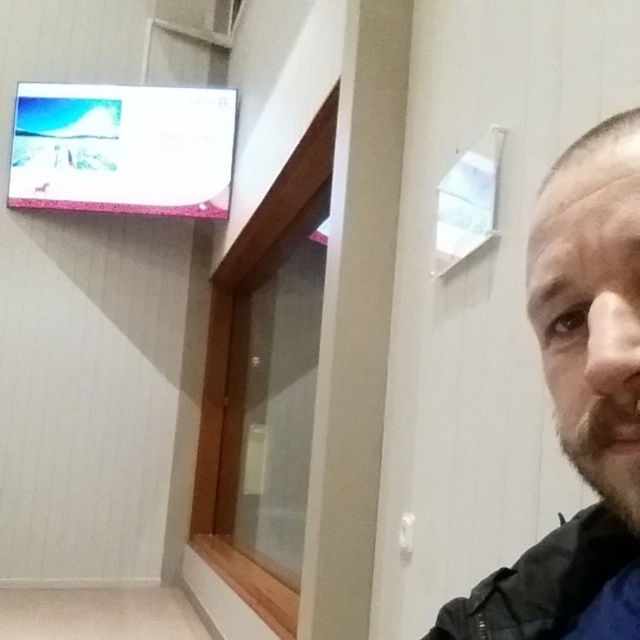
Question: Which point is farther to the camera?

Choices:
 (A) brown fuzzy beard at lower right
 (B) bearded man at right
 (C) black matte jacket at lower right

Answer: (C)

Question: Can you confirm if bearded man at right is positioned below brown fuzzy beard at lower right?

Choices:
 (A) no
 (B) yes

Answer: (B)

Question: Considering the real-world distances, which object is closest to the black matte jacket at lower right?

Choices:
 (A) bearded man at right
 (B) brown fuzzy beard at lower right

Answer: (A)

Question: Does bearded man at right have a larger size compared to black matte jacket at lower right?

Choices:
 (A) no
 (B) yes

Answer: (B)

Question: Which point is farther to the camera?

Choices:
 (A) (593, 266)
 (B) (632, 438)
 (C) (529, 609)

Answer: (C)

Question: In this image, where is bearded man at right located relative to brown fuzzy beard at lower right?

Choices:
 (A) right
 (B) left

Answer: (A)